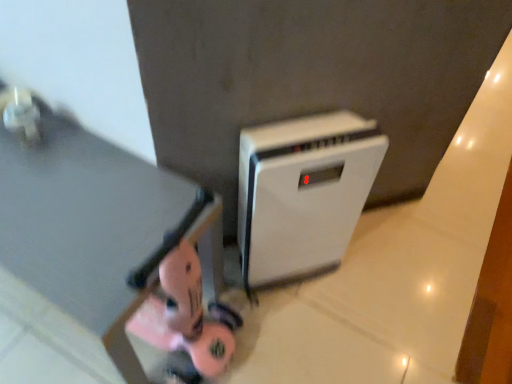
Question: Considering the positions of matte black table at lower left and white plastic air purifier at center in the image, is matte black table at lower left wider or thinner than white plastic air purifier at center?

Choices:
 (A) wide
 (B) thin

Answer: (A)

Question: Considering their positions, is matte black table at lower left located in front of or behind white plastic air purifier at center?

Choices:
 (A) front
 (B) behind

Answer: (A)

Question: From the image's perspective, is matte black table at lower left located above or below white plastic air purifier at center?

Choices:
 (A) above
 (B) below

Answer: (B)

Question: Is white plastic air purifier at center to the left or to the right of matte black table at lower left in the image?

Choices:
 (A) right
 (B) left

Answer: (A)

Question: Is white plastic air purifier at center in front of or behind matte black table at lower left in the image?

Choices:
 (A) behind
 (B) front

Answer: (A)

Question: Considering the positions of white plastic air purifier at center and matte black table at lower left in the image, is white plastic air purifier at center taller or shorter than matte black table at lower left?

Choices:
 (A) short
 (B) tall

Answer: (B)

Question: From a real-world perspective, is white plastic air purifier at center above or below matte black table at lower left?

Choices:
 (A) above
 (B) below

Answer: (A)